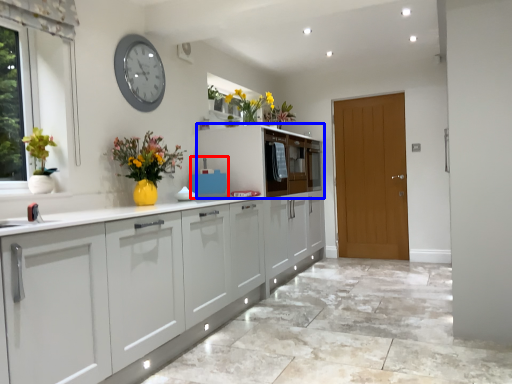
Question: Which object appears closest to the camera in this image, appliance (highlighted by a red box) or cabinetry (highlighted by a blue box)?

Choices:
 (A) appliance
 (B) cabinetry

Answer: (A)